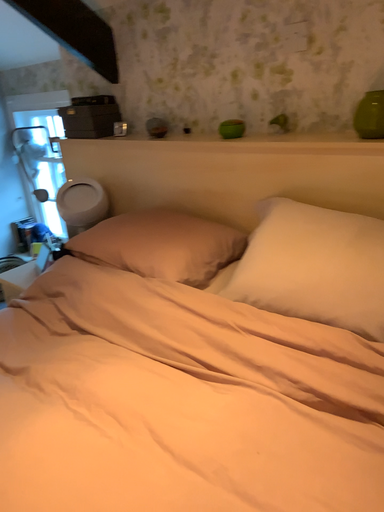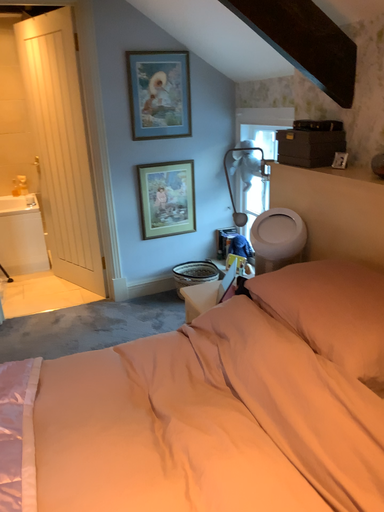
Question: How did the camera likely rotate when shooting the video?

Choices:
 (A) rotated left
 (B) rotated right

Answer: (A)